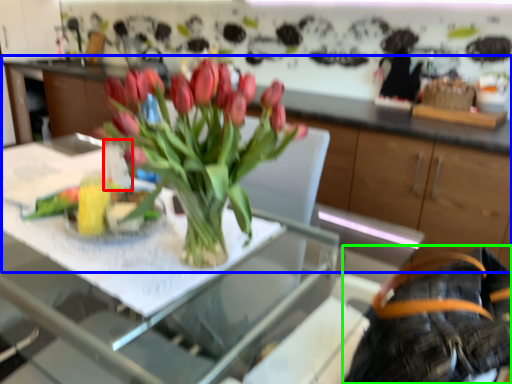
Question: Estimate the real-world distances between objects in this image. Which object is farther from vase (highlighted by a red box), cabinetry (highlighted by a blue box) or back (highlighted by a green box)?

Choices:
 (A) cabinetry
 (B) back

Answer: (A)